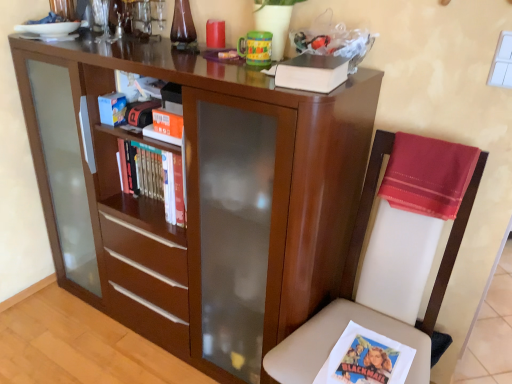
Question: Is silky red cloth at right to the left or to the right of white leather chair at right in the image?

Choices:
 (A) left
 (B) right

Answer: (B)

Question: From their relative heights in the image, would you say silky red cloth at right is taller or shorter than white leather chair at right?

Choices:
 (A) short
 (B) tall

Answer: (A)

Question: Estimate the real-world distances between objects in this image. Which object is farther from the hardcover book at upper center?

Choices:
 (A) hardcover books at center
 (B) matte wood bookcase at center
 (C) silky red cloth at right
 (D) white leather chair at right

Answer: (B)

Question: Which of these objects is positioned farthest from the matte wood bookcase at center?

Choices:
 (A) hardcover books at center
 (B) hardcover book at upper center
 (C) silky red cloth at right
 (D) white leather chair at right

Answer: (B)